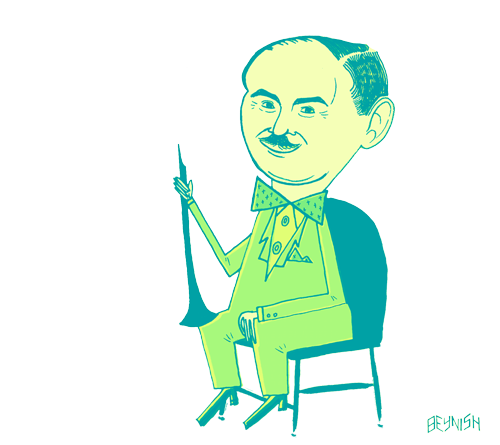
Identify the location of seat of chair. (330, 347).